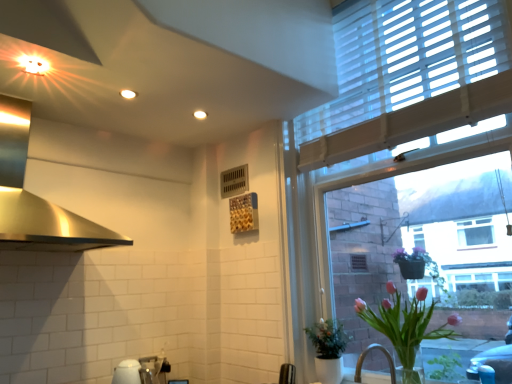
Question: Is white glossy sink at lower center looking in the opposite direction of polished stainless steel exhaust hood at upper left?

Choices:
 (A) yes
 (B) no

Answer: (B)

Question: Is white glossy sink at lower center at the left side of polished stainless steel exhaust hood at upper left?

Choices:
 (A) no
 (B) yes

Answer: (A)

Question: From a real-world perspective, is white glossy sink at lower center physically above polished stainless steel exhaust hood at upper left?

Choices:
 (A) yes
 (B) no

Answer: (B)

Question: From a real-world perspective, is white glossy sink at lower center located beneath polished stainless steel exhaust hood at upper left?

Choices:
 (A) yes
 (B) no

Answer: (A)

Question: Can we say white glossy sink at lower center lies outside polished stainless steel exhaust hood at upper left?

Choices:
 (A) no
 (B) yes

Answer: (B)

Question: Based on their positions, is white textured window at upper right located to the left or right of polished stainless steel exhaust hood at upper left?

Choices:
 (A) right
 (B) left

Answer: (A)

Question: Do you think white textured window at upper right is within polished stainless steel exhaust hood at upper left, or outside of it?

Choices:
 (A) outside
 (B) inside

Answer: (A)

Question: Based on their sizes in the image, would you say white textured window at upper right is bigger or smaller than polished stainless steel exhaust hood at upper left?

Choices:
 (A) big
 (B) small

Answer: (A)

Question: From a real-world perspective, is white textured window at upper right physically located above or below polished stainless steel exhaust hood at upper left?

Choices:
 (A) below
 (B) above

Answer: (B)

Question: Looking at the image, does pink glass vase at lower right, marked as the second houseplant in a back-to-front arrangement, seem bigger or smaller compared to white textured window at upper right?

Choices:
 (A) small
 (B) big

Answer: (A)

Question: From their relative heights in the image, would you say pink glass vase at lower right, which is the first houseplant from front to back, is taller or shorter than white textured window at upper right?

Choices:
 (A) short
 (B) tall

Answer: (A)

Question: From the image's perspective, is pink glass vase at lower right, which is the first houseplant from front to back, located above or below white textured window at upper right?

Choices:
 (A) above
 (B) below

Answer: (B)

Question: Is pink glass vase at lower right, marked as the second houseplant in a back-to-front arrangement, wider or thinner than white textured window at upper right?

Choices:
 (A) wide
 (B) thin

Answer: (A)

Question: From the image's perspective, is white textured window at upper right located above or below green matte plant at lower right, arranged as the first houseplant when viewed from the back?

Choices:
 (A) below
 (B) above

Answer: (B)

Question: From a real-world perspective, is white textured window at upper right above or below green matte plant at lower right, arranged as the first houseplant when viewed from the back?

Choices:
 (A) above
 (B) below

Answer: (A)